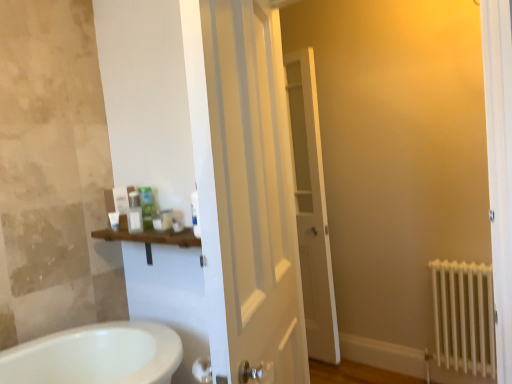
Question: Is white glossy door at center, the 2th door viewed from the back, aimed at white matte radiator at lower right?

Choices:
 (A) no
 (B) yes

Answer: (A)

Question: Does white glossy door at center, the 1th door viewed from the front, appear on the right side of white matte radiator at lower right?

Choices:
 (A) yes
 (B) no

Answer: (B)

Question: Can you confirm if white glossy door at center, the 2th door viewed from the back, is wider than white matte radiator at lower right?

Choices:
 (A) yes
 (B) no

Answer: (A)

Question: From the image's perspective, is white glossy door at center, the 1th door viewed from the front, on top of white matte radiator at lower right?

Choices:
 (A) no
 (B) yes

Answer: (B)

Question: From a real-world perspective, is white glossy door at center, the 1th door viewed from the front, positioned over white matte radiator at lower right based on gravity?

Choices:
 (A) yes
 (B) no

Answer: (A)

Question: Can you confirm if white glossy door at center, the 2th door viewed from the back, is shorter than white matte radiator at lower right?

Choices:
 (A) no
 (B) yes

Answer: (A)

Question: Can you confirm if white matte radiator at lower right is smaller than translucent plastic container at upper center, which is the 4th toiletry from left to right?

Choices:
 (A) yes
 (B) no

Answer: (B)

Question: Is white matte radiator at lower right taller than translucent plastic container at upper center, which is counted as the second toiletry, starting from the right?

Choices:
 (A) yes
 (B) no

Answer: (A)

Question: Does white matte radiator at lower right have a greater width compared to translucent plastic container at upper center, which is the 4th toiletry from left to right?

Choices:
 (A) yes
 (B) no

Answer: (B)

Question: Is white matte radiator at lower right to the right of translucent plastic container at upper center, which is counted as the second toiletry, starting from the right, from the viewer's perspective?

Choices:
 (A) no
 (B) yes

Answer: (B)

Question: From a real-world perspective, is white matte radiator at lower right on translucent plastic container at upper center, which is counted as the second toiletry, starting from the right?

Choices:
 (A) yes
 (B) no

Answer: (B)

Question: Could you tell me if white matte radiator at lower right is turned towards translucent plastic container at upper center, which is the 4th toiletry from left to right?

Choices:
 (A) yes
 (B) no

Answer: (B)

Question: Is matte plastic container at center, the 4th toiletry when ordered from right to left, taller than white glossy door at center, the 1th door viewed from the front?

Choices:
 (A) no
 (B) yes

Answer: (A)